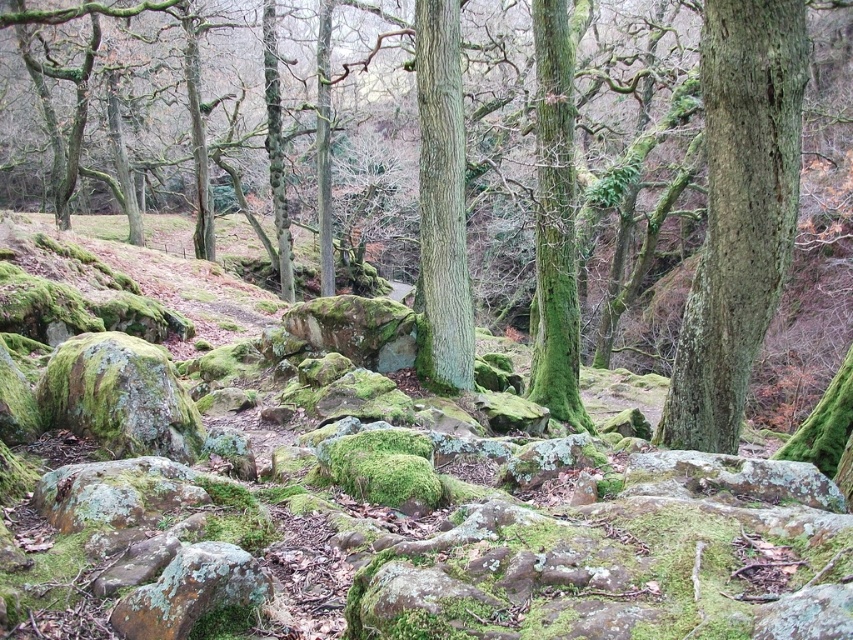
Is point (799, 52) farther from viewer compared to point (184, 625)?

Yes, it is behind point (184, 625).

Locate an element on the screen. green rough bark tree at right is located at coordinates (738, 212).

Where is `green rough bark tree at right`? Image resolution: width=853 pixels, height=640 pixels. green rough bark tree at right is located at coordinates (738, 212).

Between green mossy rock at center and green rough bark tree at center, which one is positioned lower?

Positioned lower is green mossy rock at center.

Who is higher up, green mossy rock at center or green rough bark tree at center?

green rough bark tree at center is higher up.

Does point (477, 602) come closer to viewer compared to point (461, 129)?

That is True.

What are the coordinates of `green mossy rock at center` in the screenshot? It's located at (376, 481).

Does green mossy tree at center have a smaller size compared to green mossy rock at lower left?

Incorrect, green mossy tree at center is not smaller in size than green mossy rock at lower left.

This screenshot has width=853, height=640. What do you see at coordinates (712, 358) in the screenshot?
I see `green mossy tree at center` at bounding box center [712, 358].

Locate an element on the screen. Image resolution: width=853 pixels, height=640 pixels. green mossy tree at center is located at coordinates (712, 358).